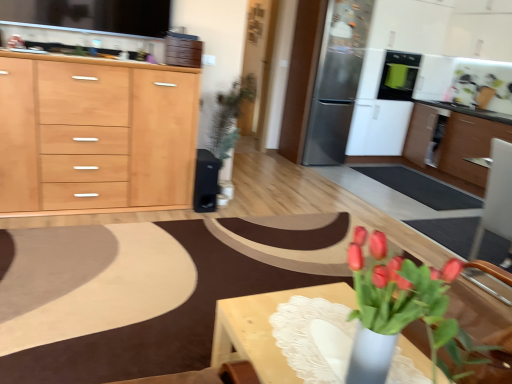
Identify the location of free space on the front side of black matte speaker at center, which ranks as the 3th appliance in back-to-front order. (196, 212).